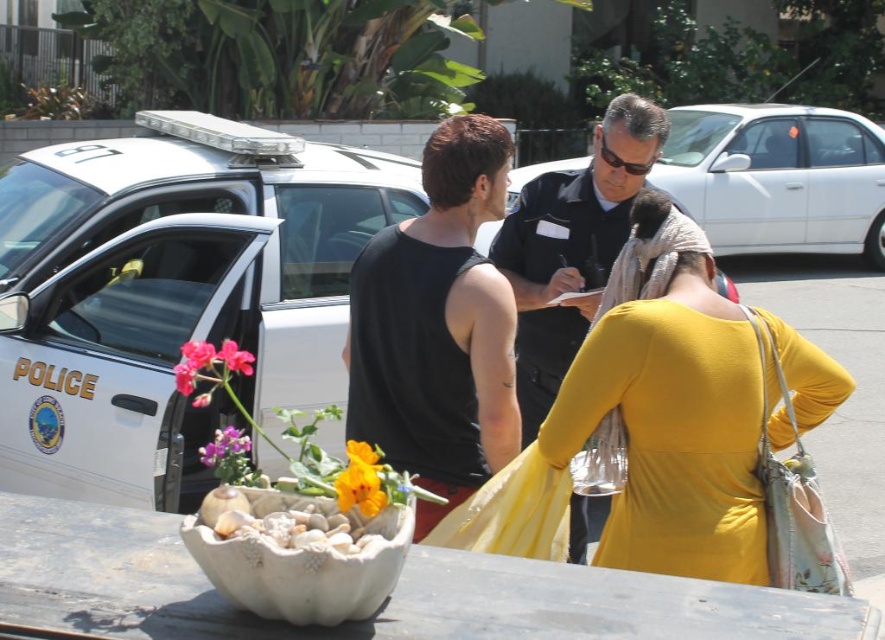
You are a delivery person who needs to place a large package next to the purple matte flower at center without blocking the white glossy police car at left. Is the package likely to block the view of the police car if placed there?

The white glossy police car at left is taller than the purple matte flower at center. Placing the package next to the flower might block the view of the police car if the package is as tall or taller than the flower, but since the police car is already taller, the package might not fully obscure it unless it is positioned directly in front and at a similar height.

You are a pedestrian standing in front of the police car and looking at the two people near the seashell planter. Which of the two, the matte yellow dress at center or the black uniform at center, appears nearer to you?

The matte yellow dress at center appears nearer to you because it is closer to the viewer than the black uniform at center.